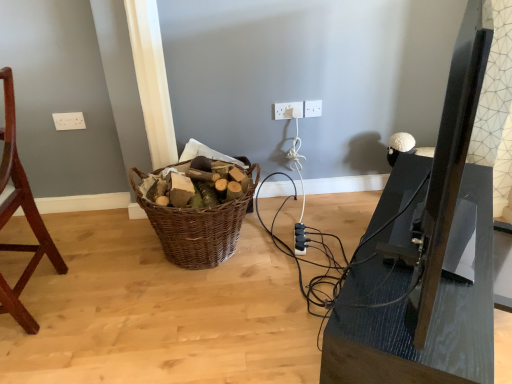
This screenshot has width=512, height=384. Identify the location of free space between black plastic extension cord at lower center and woven brown basket at center. (278, 238).